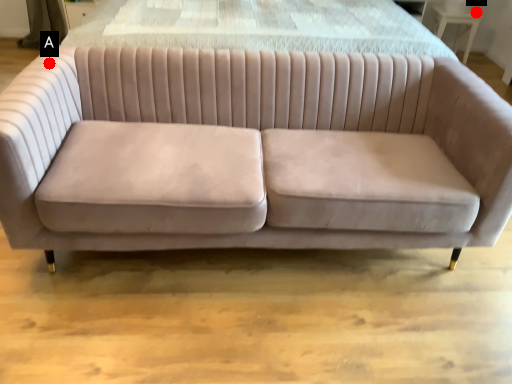
Question: Two points are circled on the image, labeled by A and B beside each circle. Which point is closer to the camera?

Choices:
 (A) A is closer
 (B) B is closer

Answer: (A)